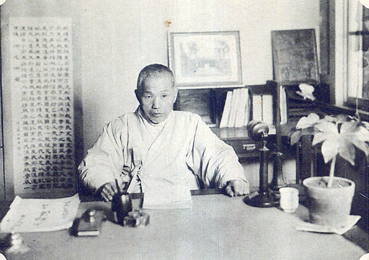
At what (x,y) coordinates should I click in order to perform the action: click on plant. Please return your answer as a coordinate pair (x, y). The height and width of the screenshot is (260, 369). Looking at the image, I should click on (340, 131).